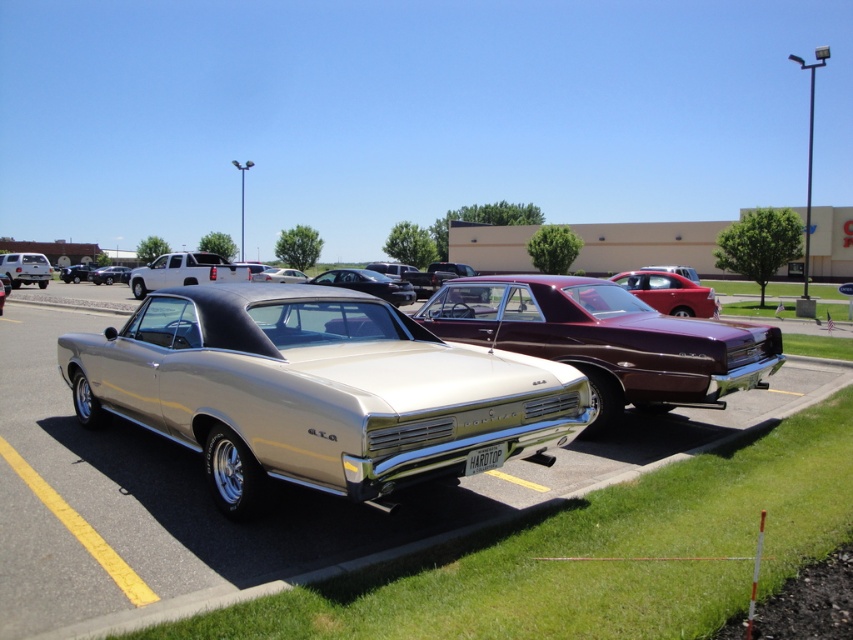
You are standing at the point labeled point [368,284] in the parking lot. Which car are you closest to?

You are closest to the shiny black car at center because the point [368,284] is located on it.

You are a delivery person who needs to park your van between the shiny black car at center and the shiny gold car at center. Is there enough space between them to fit your van that is 2 meters wide?

The shiny black car at center is positioned on the right side of the shiny gold car at center, but the exact distance between them isn not provided in the scene description. Therefore, it is uncertain if there is enough space for the van.

You are a delivery person who needs to park a 10 meter long truck between the shiny black car at center and the matte white truck at left. Is there enough space between them to park your truck?

The distance between the shiny black car at center and the matte white truck at left is 21.67 meters. Since the truck is 10 meters long, there is sufficient space to park it between them.